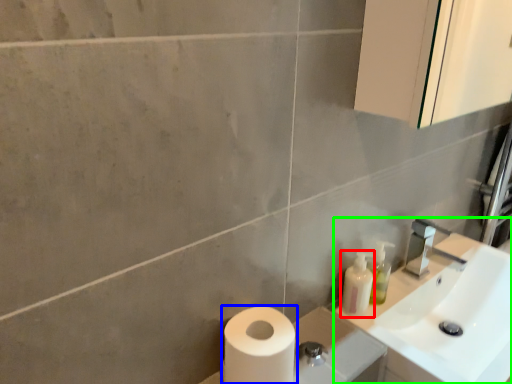
Question: Which is farther away from toiletry (highlighted by a red box)? toilet paper (highlighted by a blue box) or sink (highlighted by a green box)?

Choices:
 (A) toilet paper
 (B) sink

Answer: (A)